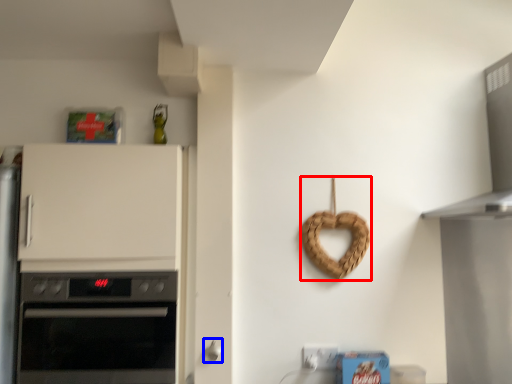
Question: Among these objects, which one is farthest to the camera, appliance (highlighted by a red box) or door handle (highlighted by a blue box)?

Choices:
 (A) appliance
 (B) door handle

Answer: (A)